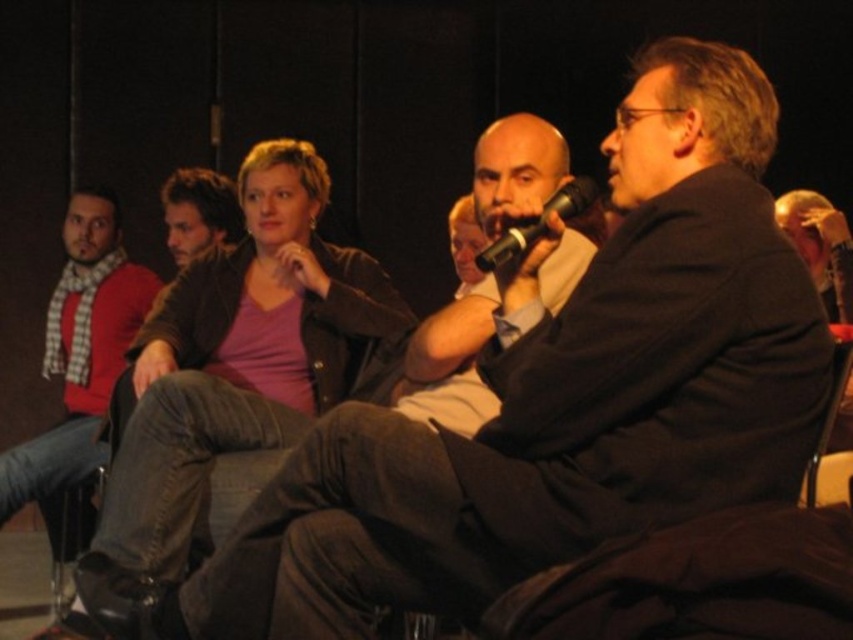
Question: Which object is closer to the camera taking this photo?

Choices:
 (A) red checkered scarf at left
 (B) pink matte jacket at upper center

Answer: (B)

Question: Is pink matte jacket at upper center behind black matte microphone at center?

Choices:
 (A) yes
 (B) no

Answer: (A)

Question: Estimate the real-world distances between objects in this image. Which object is farther from the red checkered scarf at left?

Choices:
 (A) pink matte jacket at upper center
 (B) black matte microphone at center

Answer: (B)

Question: Can you confirm if pink matte jacket at upper center is thinner than black matte microphone at center?

Choices:
 (A) no
 (B) yes

Answer: (A)

Question: Which point appears farthest from the camera in this image?

Choices:
 (A) (474, 260)
 (B) (140, 285)

Answer: (B)

Question: Does red checkered scarf at left appear under black matte microphone at center?

Choices:
 (A) no
 (B) yes

Answer: (B)